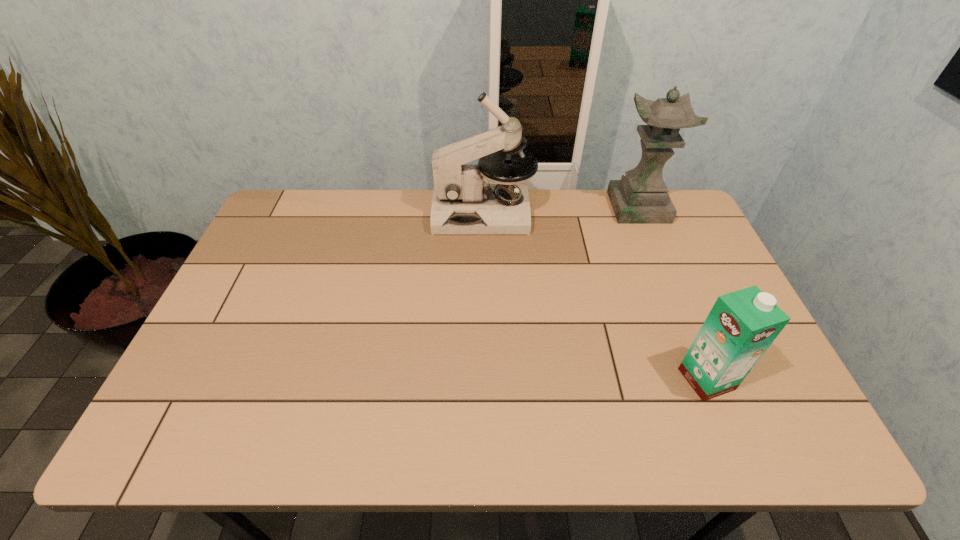
This screenshot has height=540, width=960. What are the coordinates of `vacant space in between the shortest object and the sculpture` in the screenshot? It's located at (672, 293).

Select which object is the closest to the microscope. Please provide its 2D coordinates. Your answer should be formatted as a tuple, i.e. [(x, y)], where the tuple contains the x and y coordinates of a point satisfying the conditions above.

[(640, 197)]

What are the coordinates of `object that stands as the second closest to the sculpture` in the screenshot? It's located at (741, 326).

Find the location of a particular element. This screenshot has height=540, width=960. free location that satisfies the following two spatial constraints: 1. at the eyepiece of the nearest object; 2. on the left side of the microscope is located at coordinates (485, 379).

The width and height of the screenshot is (960, 540). Identify the location of free location that satisfies the following two spatial constraints: 1. at the eyepiece of the nearest object; 2. on the right side of the microscope. (485, 379).